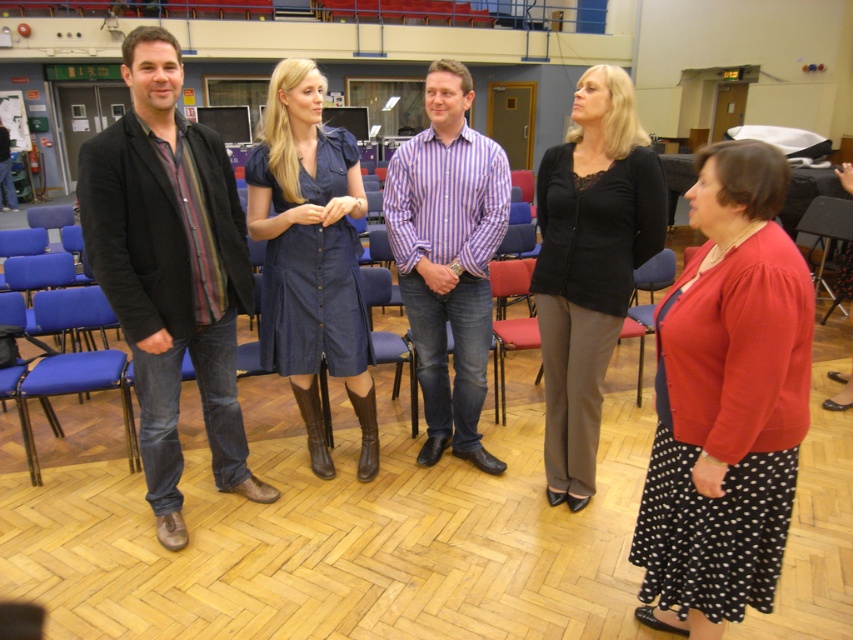
What do you see at coordinates (170, 269) in the screenshot? Image resolution: width=853 pixels, height=640 pixels. I see `matte black blazer at left` at bounding box center [170, 269].

Image resolution: width=853 pixels, height=640 pixels. Identify the location of matte black blazer at left. (170, 269).

Is point (679, 628) less distant than point (88, 205)?

Yes.

What do you see at coordinates (726, 403) in the screenshot? I see `black dotted skirt at lower right` at bounding box center [726, 403].

Is point (692, 262) more distant than point (206, 129)?

No, (692, 262) is closer to viewer.

Identify the location of black dotted skirt at lower right. pyautogui.click(x=726, y=403).

Is denim dress at center to the left of striped cotton shirt at center from the viewer's perspective?

Yes, denim dress at center is to the left of striped cotton shirt at center.

Based on the photo, is denim dress at center above striped cotton shirt at center?

No.

Which is behind, point (370, 424) or point (440, 355)?

Point (370, 424)

This screenshot has height=640, width=853. Identify the location of denim dress at center. (311, 256).